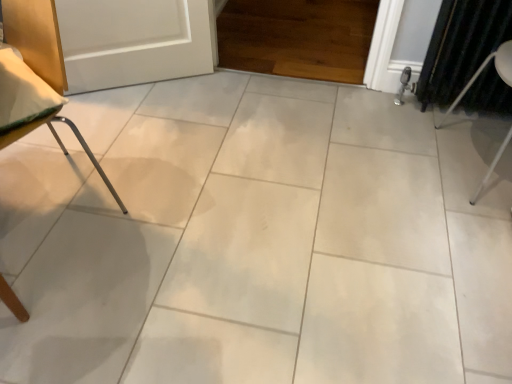
This screenshot has width=512, height=384. Find the location of `vacant space positioned to the left of white metal chair at right, the first furniture positioned from the right`. vacant space positioned to the left of white metal chair at right, the first furniture positioned from the right is located at coordinates (404, 161).